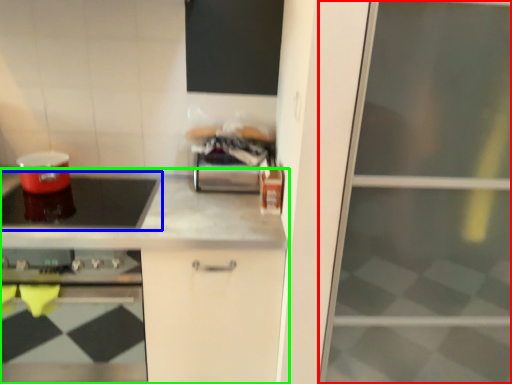
Question: Which object is the farthest from screen door (highlighted by a red box)? Choose among these: kitchen appliance (highlighted by a blue box) or countertop (highlighted by a green box).

Choices:
 (A) kitchen appliance
 (B) countertop

Answer: (A)